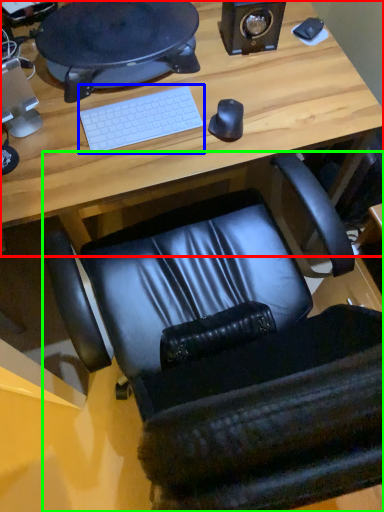
Question: Which is farther away from desk (highlighted by a red box)? computer keyboard (highlighted by a blue box) or chair (highlighted by a green box)?

Choices:
 (A) computer keyboard
 (B) chair

Answer: (B)